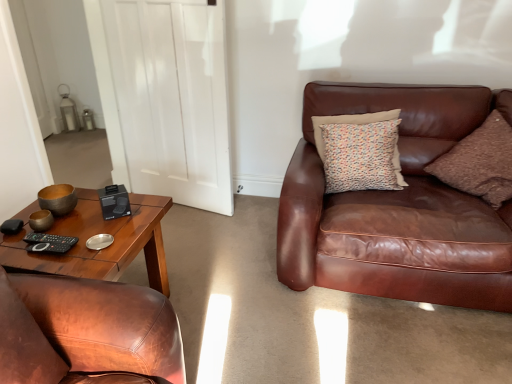
Question: Is matte brown pillow at lower left, arranged as the third pillow when viewed from the right, positioned with its back to brown leather chair at left?

Choices:
 (A) yes
 (B) no

Answer: (B)

Question: From a real-world perspective, does matte brown pillow at lower left, which is counted as the first pillow, starting from the front, stand above brown leather chair at left?

Choices:
 (A) yes
 (B) no

Answer: (A)

Question: Does matte brown pillow at lower left, which is counted as the 3th pillow, starting from the back, have a lesser width compared to brown leather chair at left?

Choices:
 (A) yes
 (B) no

Answer: (A)

Question: Considering the relative sizes of matte brown pillow at lower left, acting as the first pillow starting from the left, and brown leather chair at left in the image provided, is matte brown pillow at lower left, acting as the first pillow starting from the left, bigger than brown leather chair at left?

Choices:
 (A) yes
 (B) no

Answer: (B)

Question: Can you confirm if matte brown pillow at lower left, which is counted as the first pillow, starting from the front, is shorter than brown leather chair at left?

Choices:
 (A) no
 (B) yes

Answer: (B)

Question: Is brown leather chair at left surrounded by matte brown pillow at lower left, acting as the first pillow starting from the left?

Choices:
 (A) no
 (B) yes

Answer: (A)

Question: Considering the relative sizes of brown corduroy pillow at right, the 3th pillow viewed from the left, and brown leather couch at right in the image provided, is brown corduroy pillow at right, the 3th pillow viewed from the left, bigger than brown leather couch at right?

Choices:
 (A) yes
 (B) no

Answer: (B)

Question: Can you confirm if brown corduroy pillow at right, the 3th pillow viewed from the left, is shorter than brown leather couch at right?

Choices:
 (A) yes
 (B) no

Answer: (A)

Question: Is brown corduroy pillow at right, the 3th pillow viewed from the left, in front of brown leather couch at right?

Choices:
 (A) no
 (B) yes

Answer: (A)

Question: Is brown corduroy pillow at right, the 2th pillow viewed from the back, oriented away from brown leather couch at right?

Choices:
 (A) yes
 (B) no

Answer: (A)

Question: Is brown corduroy pillow at right, the 3th pillow viewed from the left, to the left of brown leather couch at right from the viewer's perspective?

Choices:
 (A) yes
 (B) no

Answer: (B)

Question: Is brown corduroy pillow at right, the 3th pillow viewed from the left, not close to brown leather couch at right?

Choices:
 (A) no
 (B) yes

Answer: (A)

Question: From a real-world perspective, is brown leather chair at left on black matte remote at lower left?

Choices:
 (A) no
 (B) yes

Answer: (A)